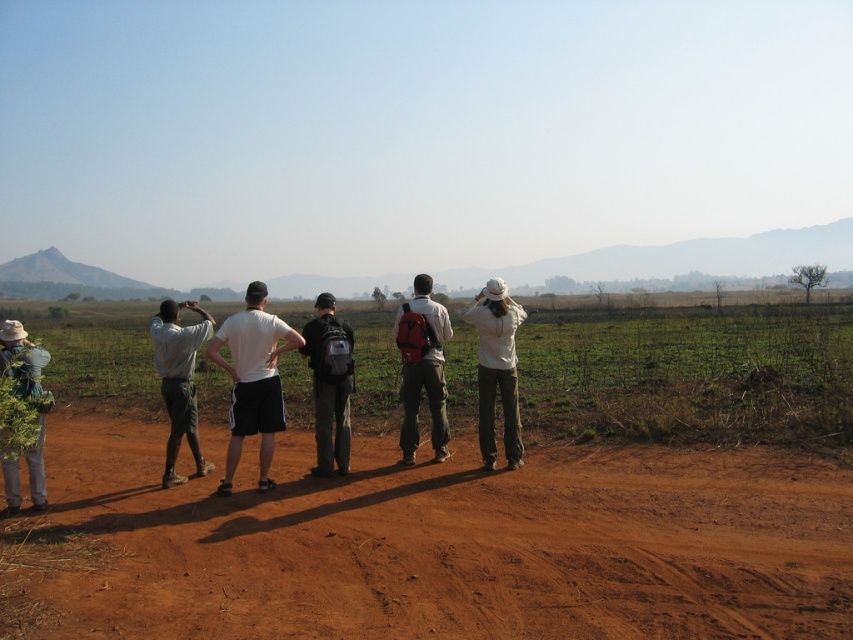
Does matte red backpack at center appear on the right side of green leafy plant at left?

Correct, you'll find matte red backpack at center to the right of green leafy plant at left.

Based on the photo, who is more distant from viewer, (403, 435) or (39, 356)?

The point (403, 435) is more distant.

The width and height of the screenshot is (853, 640). Identify the location of matte red backpack at center. (422, 369).

Does point (407, 464) lie in front of point (184, 417)?

No, (407, 464) is further to viewer.

Which is behind, point (405, 349) or point (175, 369)?

Positioned behind is point (405, 349).

Does point (415, 419) come farther from viewer compared to point (178, 333)?

Yes, it is.

Where is `matte red backpack at center`? This screenshot has height=640, width=853. matte red backpack at center is located at coordinates (422, 369).

Who is lower down, white matte hat at center or matte white shirt at left?

matte white shirt at left is lower down.

Is white matte hat at center thinner than matte white shirt at left?

Yes.

Who is more forward, (466, 320) or (164, 330)?

Point (164, 330) is in front.

Identify the location of white matte hat at center. (496, 369).